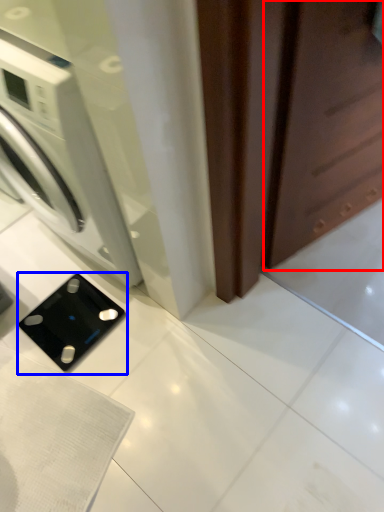
Question: Which point is closer to the camera, screen door (highlighted by a red box) or appliance (highlighted by a blue box)?

Choices:
 (A) screen door
 (B) appliance

Answer: (A)